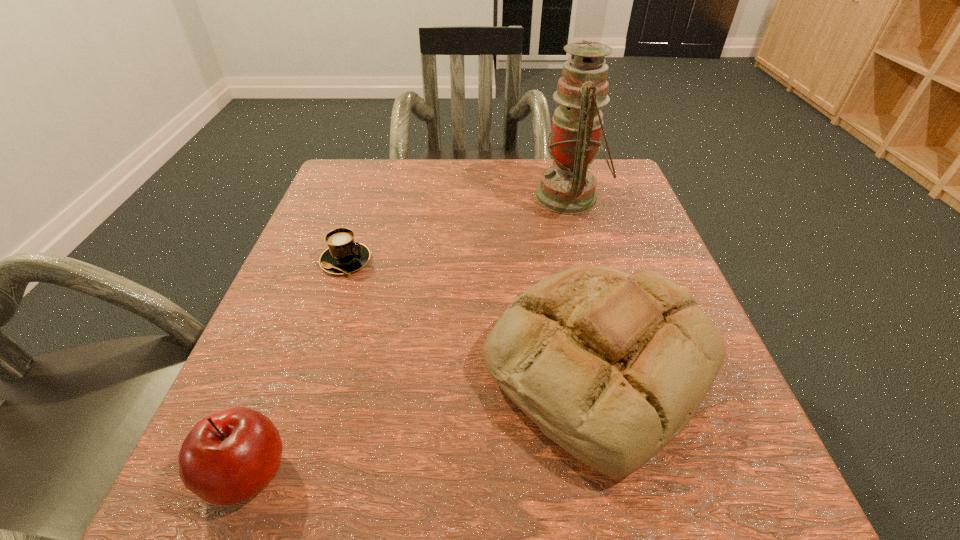
The width and height of the screenshot is (960, 540). What are the coordinates of `vacant area at the far edge of the desktop` in the screenshot? It's located at (467, 169).

The image size is (960, 540). I want to click on vacant space at the near edge of the desktop, so click(x=348, y=515).

This screenshot has width=960, height=540. What are the coordinates of `free space at the left edge of the desktop` in the screenshot? It's located at (303, 314).

The image size is (960, 540). I want to click on free space at the far left corner of the desktop, so click(x=387, y=192).

The width and height of the screenshot is (960, 540). In order to click on vacant position at the near left corner of the desktop in this screenshot , I will do `click(300, 453)`.

This screenshot has width=960, height=540. I want to click on free space between the apple and the cappuccino, so click(x=297, y=367).

Image resolution: width=960 pixels, height=540 pixels. I want to click on empty space that is in between the oil lamp and the apple, so click(x=409, y=335).

Image resolution: width=960 pixels, height=540 pixels. What are the coordinates of `unoccupied position between the apple and the second farthest object` in the screenshot? It's located at (297, 367).

Identify the location of vacant area that lies between the oil lamp and the apple. Image resolution: width=960 pixels, height=540 pixels. point(409,335).

In order to click on vacant space that is in between the cappuccino and the oil lamp in this screenshot , I will do [458, 229].